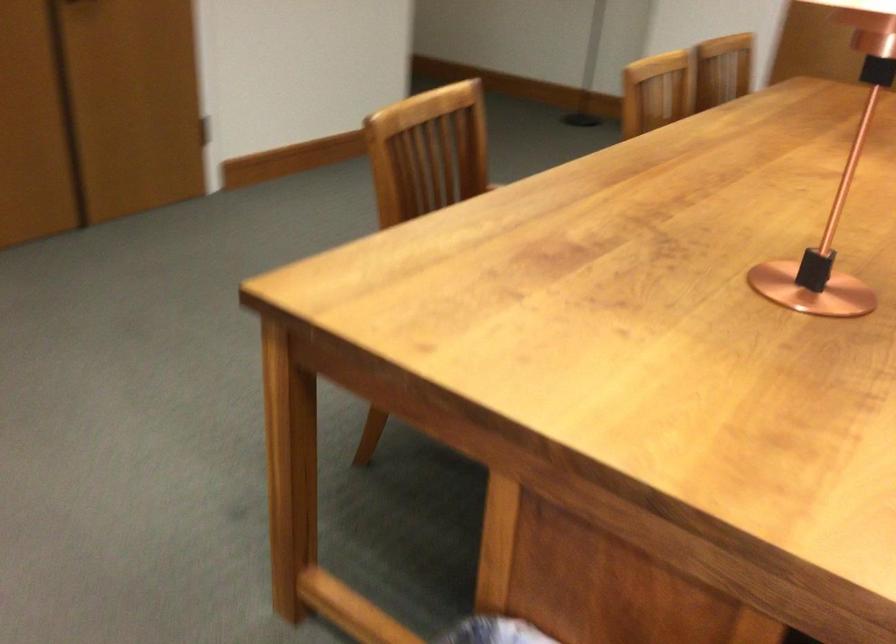
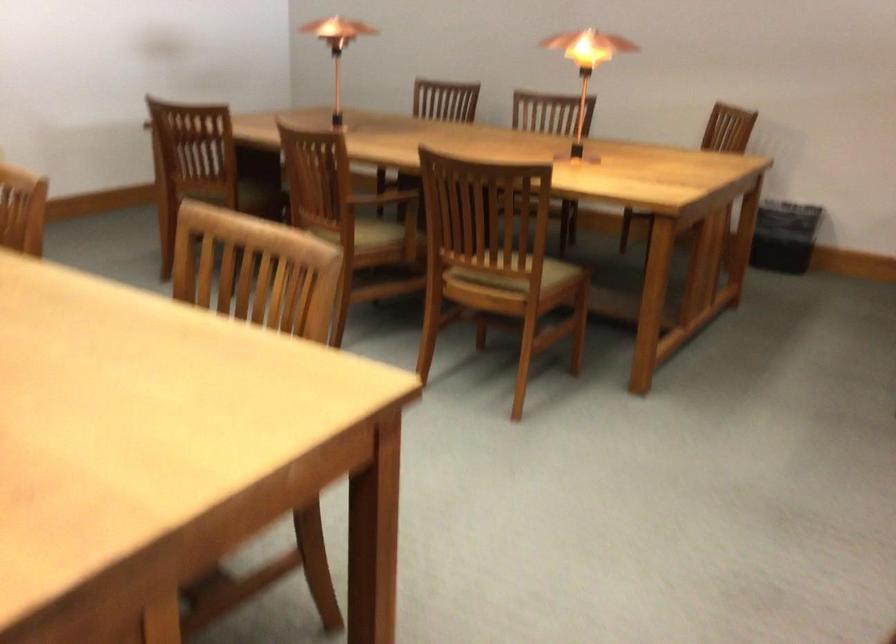
The images are taken continuously from a first-person perspective. In which direction is your viewpoint rotating?

The rotation direction of the camera is right-down.